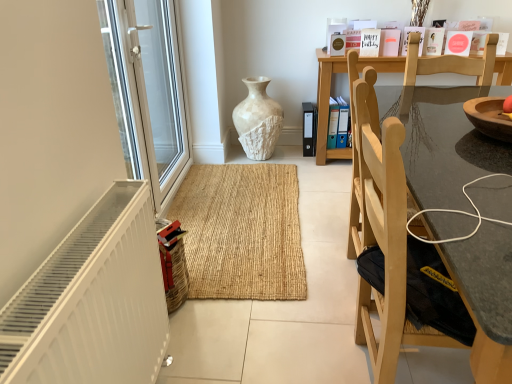
This screenshot has width=512, height=384. Identify the location of vacant area on top of white matte radiator at lower left (from a real-world perspective). (91, 236).